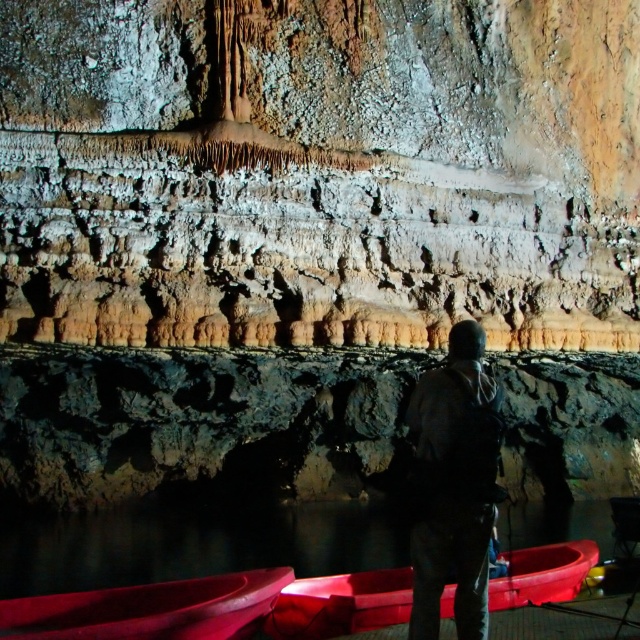
You are navigating inside a cave with two red kayaks on the water. You see two points marked in the image. Which point is closer to you, point (484, 376) or point (340, 577)?

Point (484, 376) is closer to the viewer than point (340, 577).

You are navigating a cave with two red kayaks in the water. You see a point marked at coordinates [454,484]. What object is located at that point?

The point at coordinates [454,484] corresponds to the dark gray fabric jacket at center.